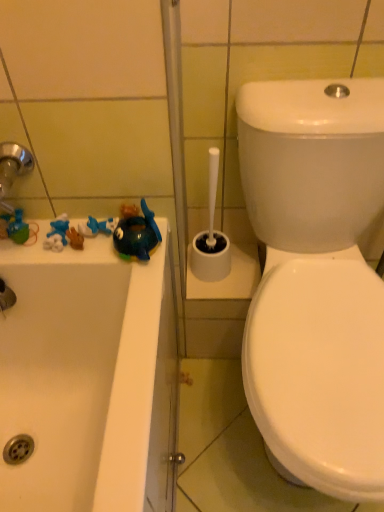
Question: In the image, is white plastic toilet brush holder at center positioned in front of or behind matte green toy at left, the third toy viewed from the right?

Choices:
 (A) behind
 (B) front

Answer: (A)

Question: From a real-world perspective, is white plastic toilet brush holder at center physically located above or below matte green toy at left, acting as the first toy starting from the left?

Choices:
 (A) below
 (B) above

Answer: (A)

Question: Estimate the real-world distances between objects in this image. Which object is closer to the glossy plastic toy at left, acting as the third toy starting from the left?

Choices:
 (A) matte green toy at left, acting as the first toy starting from the left
 (B) white plastic toilet brush holder at center
 (C) blue rubber toy at left, which is the 2th toy in right-to-left order

Answer: (C)

Question: Which object is positioned closest to the matte green toy at left, the third toy viewed from the right?

Choices:
 (A) glossy plastic toy at left, acting as the third toy starting from the left
 (B) white plastic toilet brush holder at center
 (C) blue rubber toy at left, the second toy positioned from the left

Answer: (C)